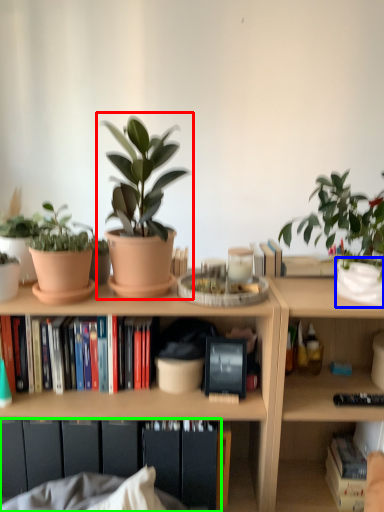
Question: Which object is the closest to the houseplant (highlighted by a red box)? Choose among these: flowerpot (highlighted by a blue box) or cabinet (highlighted by a green box).

Choices:
 (A) flowerpot
 (B) cabinet

Answer: (B)